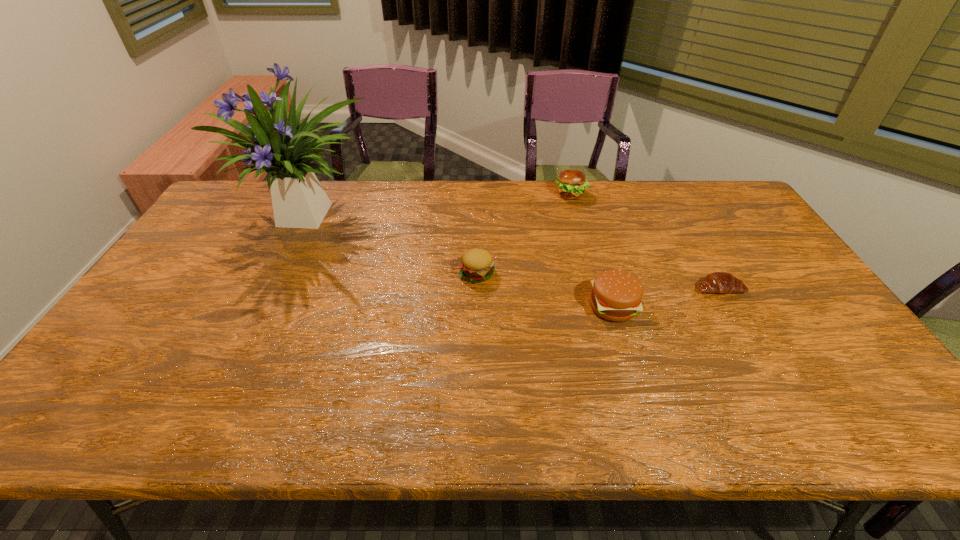
Choose which object is the fourth nearest neighbor to the nearest hamburger. Please provide its 2D coordinates. Your answer should be formatted as a tuple, i.e. [(x, y)], where the tuple contains the x and y coordinates of a point satisfying the conditions above.

[(299, 201)]

Identify which hamburger is the third closest to the crescent roll. Please provide its 2D coordinates. Your answer should be formatted as a tuple, i.e. [(x, y)], where the tuple contains the x and y coordinates of a point satisfying the conditions above.

[(477, 265)]

At what (x,y) coordinates should I click in order to perform the action: click on the closest hamburger to the farthest hamburger. Please return your answer as a coordinate pair (x, y). Looking at the image, I should click on (477, 265).

The image size is (960, 540). I want to click on free location that satisfies the following two spatial constraints: 1. on the front side of the farthest hamburger; 2. on the left side of the crescent roll, so click(x=596, y=288).